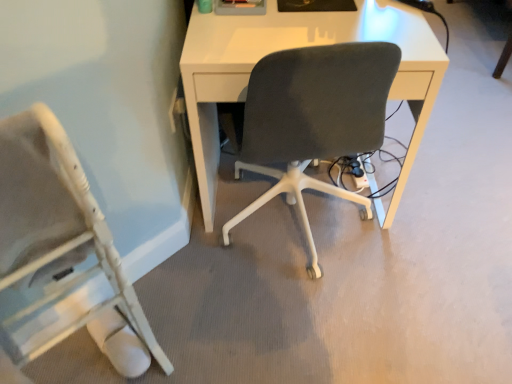
You are a GUI agent. You are given a task and a screenshot of the screen. Output one action in this format:
    pyautogui.click(x=<x>, y=<y>)
    Task: Click on the unoccupied region to the right of white matte desk at center
    The height and width of the screenshot is (384, 512).
    Given the screenshot: What is the action you would take?
    pyautogui.click(x=437, y=206)